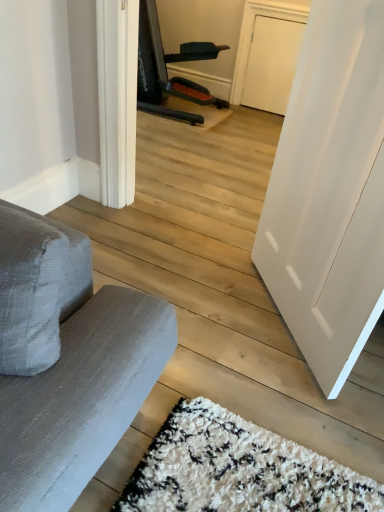
Where is `vacant space underneath white smooth door at right (from a real-world perspective)`? This screenshot has width=384, height=512. vacant space underneath white smooth door at right (from a real-world perspective) is located at coordinates (276, 320).